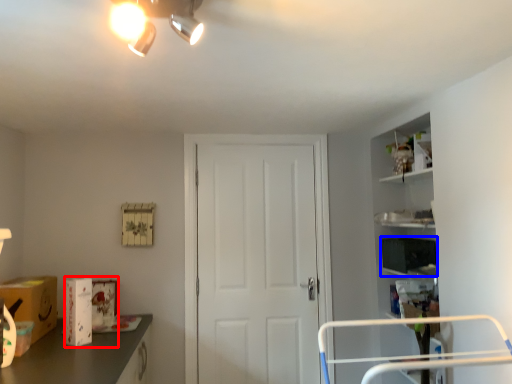
Question: Which point is closer to the camera, box (highlighted by a red box) or box (highlighted by a blue box)?

Choices:
 (A) box
 (B) box

Answer: (A)